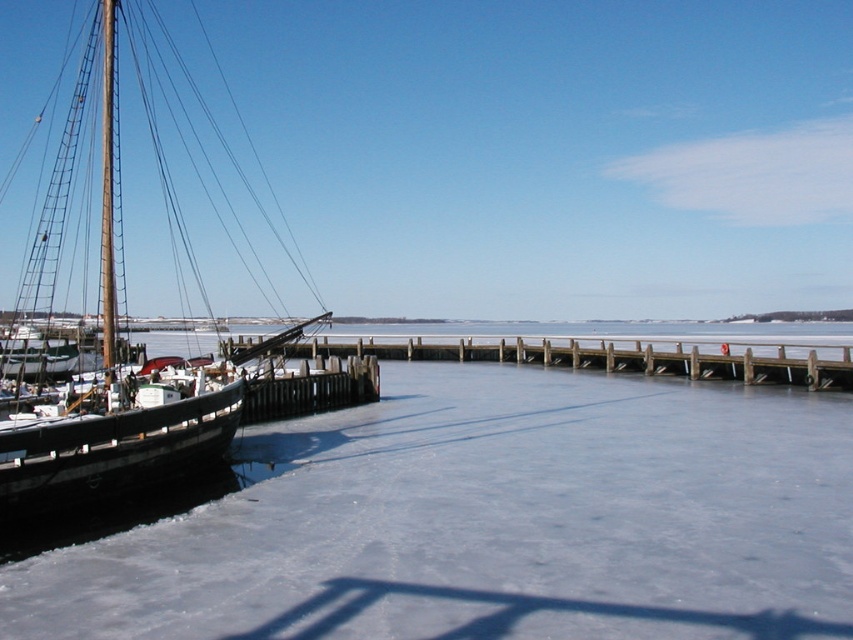
Question: Which of the following is the closest to the observer?

Choices:
 (A) wooden mast at left
 (B) wooden sailboat at left
 (C) wooden at left
 (D) white matte sailboat at left

Answer: (B)

Question: Is wooden sailboat at left to the right of wooden mast at left from the viewer's perspective?

Choices:
 (A) no
 (B) yes

Answer: (A)

Question: Which is farther from the white matte sailboat at left?

Choices:
 (A) wooden sailboat at left
 (B) white matte snow at center
 (C) wooden at left
 (D) wooden mast at left

Answer: (C)

Question: Is white matte snow at center smaller than white matte sailboat at left?

Choices:
 (A) yes
 (B) no

Answer: (B)

Question: Is white matte snow at center below white matte sailboat at left?

Choices:
 (A) yes
 (B) no

Answer: (A)

Question: Which point appears closest to the camera in this image?

Choices:
 (A) (721, 458)
 (B) (67, 349)

Answer: (A)